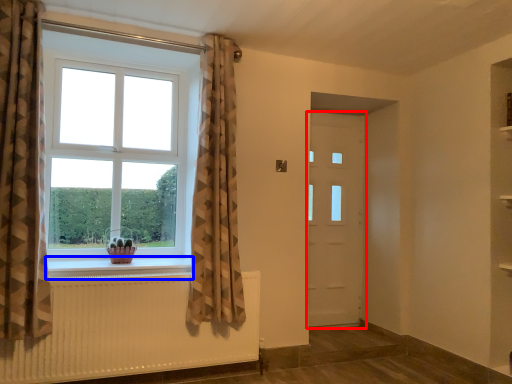
Question: Which object appears farthest to the camera in this image, door (highlighted by a red box) or window sill (highlighted by a blue box)?

Choices:
 (A) door
 (B) window sill

Answer: (A)